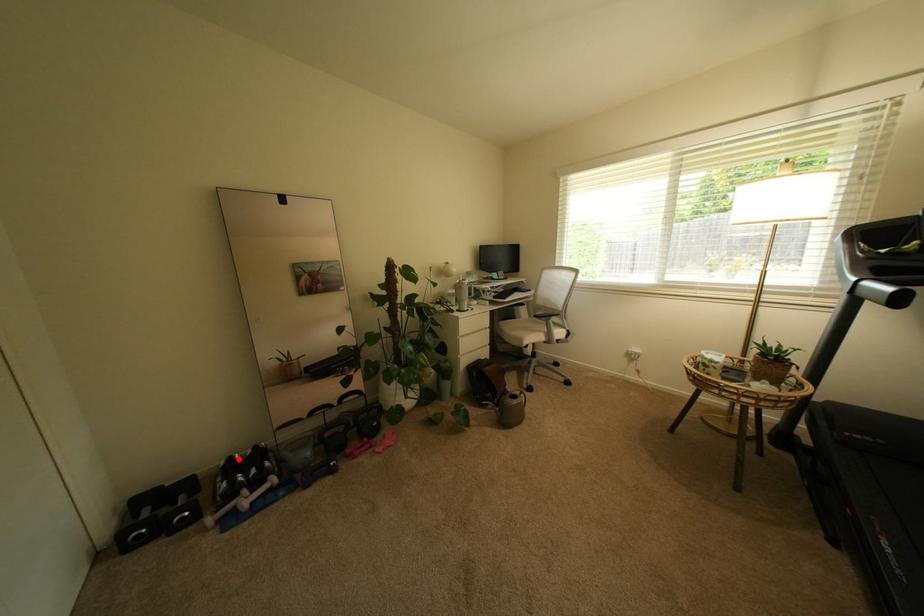
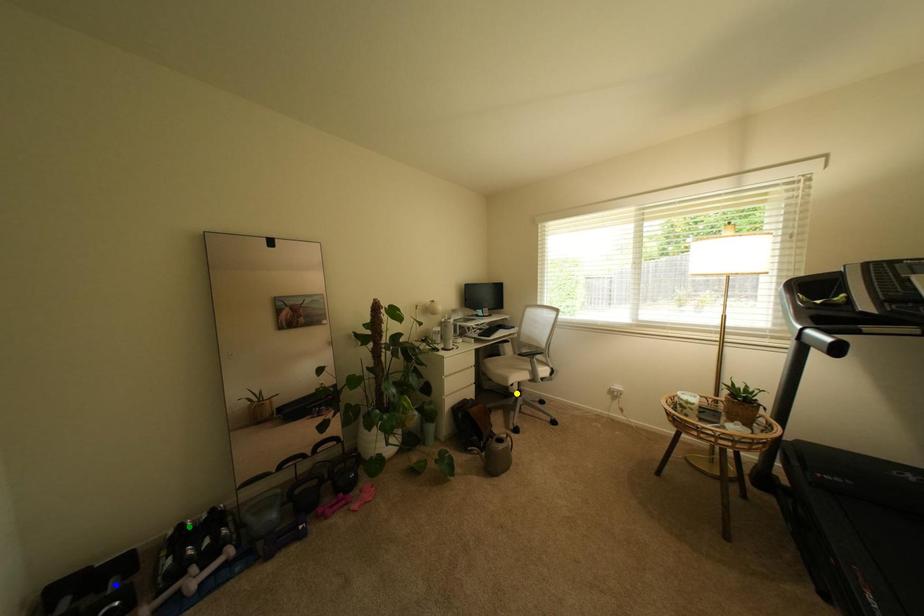
Question: I am providing you with two images of the same scene from different viewpoints. A red point is marked on the first image. You are given multiple points on the second image. In image 2, which mark is for the same physical point as the one in image 1?

Choices:
 (A) blue point
 (B) green point
 (C) yellow point

Answer: (B)